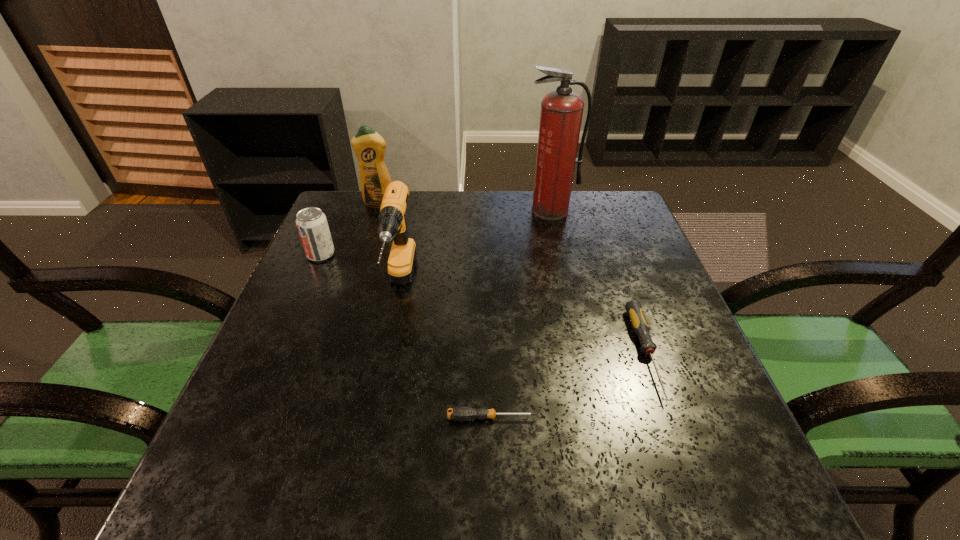
Image resolution: width=960 pixels, height=540 pixels. I want to click on free region that satisfies the following two spatial constraints: 1. on the label of the shortest object; 2. on the right side of the second object from left to right, so click(310, 418).